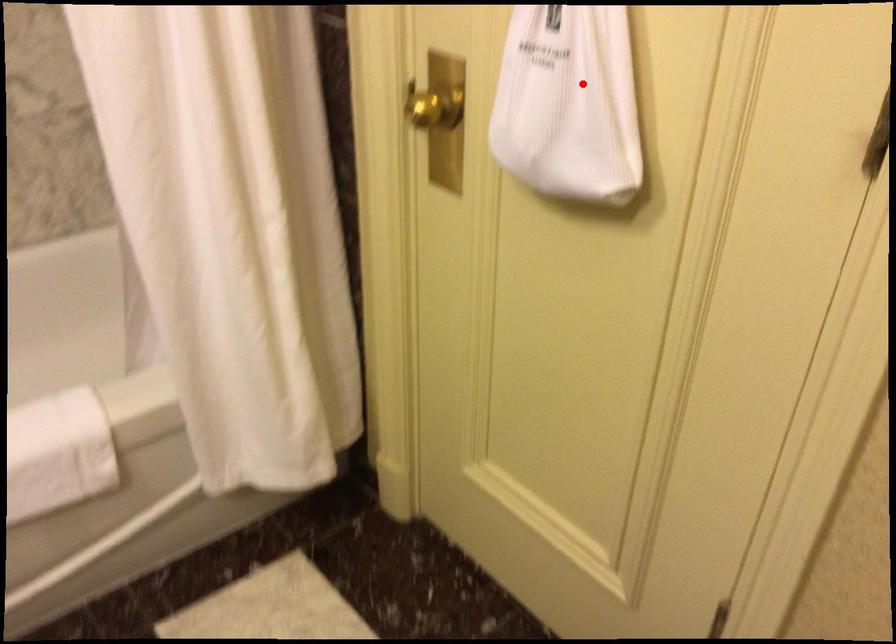
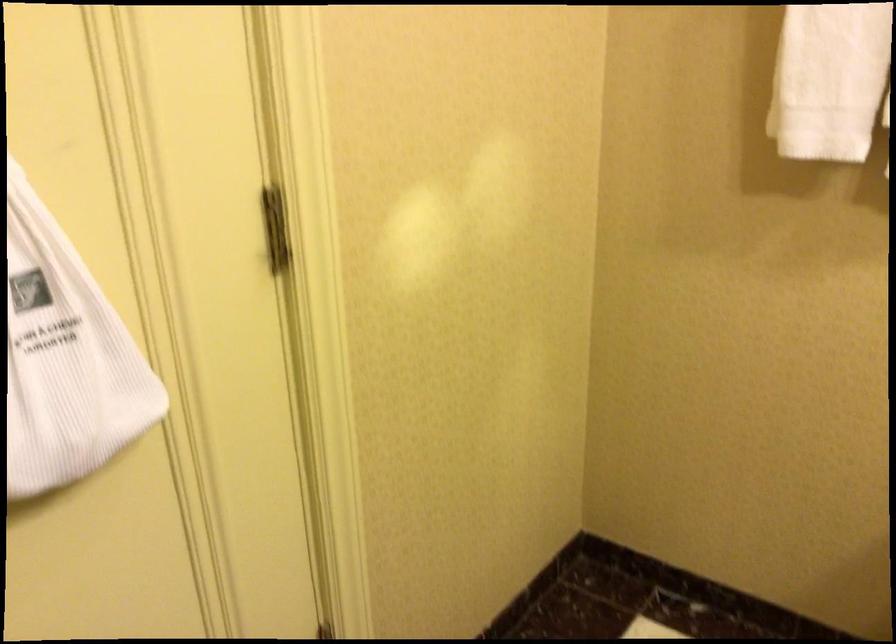
Where in the second image is the point corresponding to the highlighted location from the first image?

(65, 357)